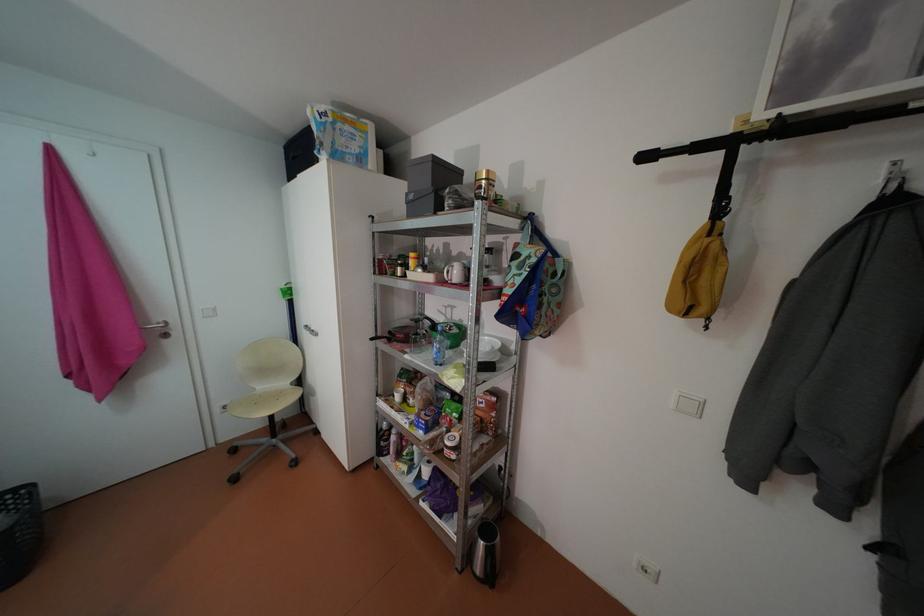
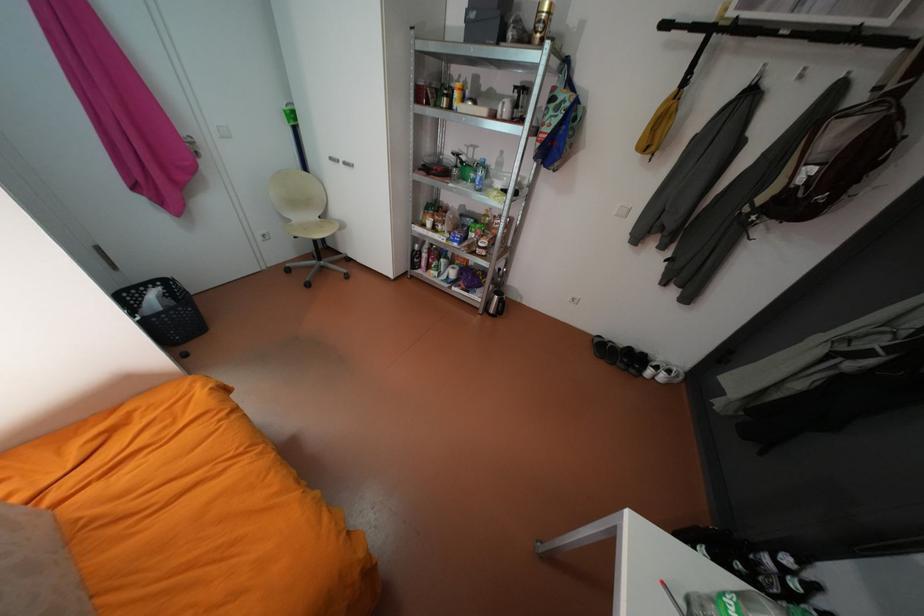
In the second image, find the point that corresponds to (x=707, y=147) in the first image.

(703, 26)